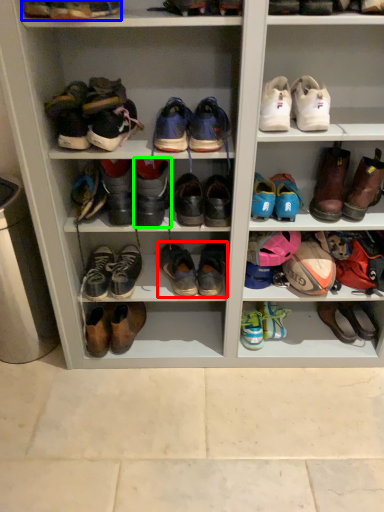
Question: Which is nearer to the footwear (highlighted by a red box)? footwear (highlighted by a blue box) or footwear (highlighted by a green box).

Choices:
 (A) footwear
 (B) footwear

Answer: (B)